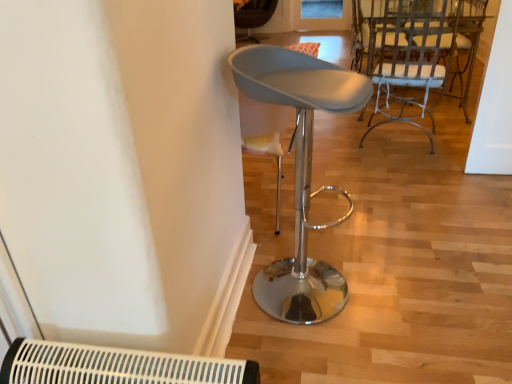
Question: Is there a large distance between white painted metal chair at upper right, which is the 3th chair in left-to-right order, and matte gray stool at center, the third chair viewed from the back?

Choices:
 (A) no
 (B) yes

Answer: (B)

Question: Is white painted metal chair at upper right, the second chair from the back, positioned beyond the bounds of matte gray stool at center, marked as the 2th chair in a left-to-right arrangement?

Choices:
 (A) no
 (B) yes

Answer: (B)

Question: Could you tell me if white painted metal chair at upper right, which is counted as the 2th chair, starting from the bottom, is facing matte gray stool at center, the third chair viewed from the back?

Choices:
 (A) yes
 (B) no

Answer: (B)

Question: From the image's perspective, does white painted metal chair at upper right, the second chair from the back, appear higher than matte gray stool at center, which appears as the 2th chair when viewed from the right?

Choices:
 (A) yes
 (B) no

Answer: (A)

Question: Does white painted metal chair at upper right, the 1th chair from the right, have a lesser width compared to matte gray stool at center, marked as the 2th chair in a left-to-right arrangement?

Choices:
 (A) no
 (B) yes

Answer: (A)

Question: Considering their positions, is white painted metal chair at upper right, the 2th chair viewed from the front, located in front of or behind white plastic air conditioning unit at lower left?

Choices:
 (A) behind
 (B) front

Answer: (A)

Question: Is white painted metal chair at upper right, the 1th chair from the right, bigger or smaller than white plastic air conditioning unit at lower left?

Choices:
 (A) big
 (B) small

Answer: (A)

Question: From the image's perspective, relative to white plastic air conditioning unit at lower left, is white painted metal chair at upper right, the 2th chair viewed from the front, above or below?

Choices:
 (A) above
 (B) below

Answer: (A)

Question: Is white painted metal chair at upper right, which is the 2th chair in top-to-bottom order, spatially inside white plastic air conditioning unit at lower left, or outside of it?

Choices:
 (A) outside
 (B) inside

Answer: (A)

Question: Considering their positions, is matte gray stool at center, the 1th chair in the front-to-back sequence, located in front of or behind velvet brown chair at center, the third chair positioned from the right?

Choices:
 (A) behind
 (B) front

Answer: (B)

Question: Based on their sizes in the image, would you say matte gray stool at center, the third chair viewed from the back, is bigger or smaller than velvet brown chair at center, the first chair when ordered from back to front?

Choices:
 (A) big
 (B) small

Answer: (B)

Question: In terms of width, does matte gray stool at center, which ranks as the third chair in top-to-bottom order, look wider or thinner when compared to velvet brown chair at center, marked as the third chair in a front-to-back arrangement?

Choices:
 (A) thin
 (B) wide

Answer: (A)

Question: From a real-world perspective, is matte gray stool at center, the third chair viewed from the back, positioned above or below velvet brown chair at center, the third chair positioned from the right?

Choices:
 (A) above
 (B) below

Answer: (A)

Question: Is white plastic air conditioning unit at lower left taller or shorter than matte gray stool at center, which ranks as the third chair in top-to-bottom order?

Choices:
 (A) tall
 (B) short

Answer: (B)

Question: From the image's perspective, is white plastic air conditioning unit at lower left located above or below matte gray stool at center, which ranks as the third chair in top-to-bottom order?

Choices:
 (A) above
 (B) below

Answer: (B)